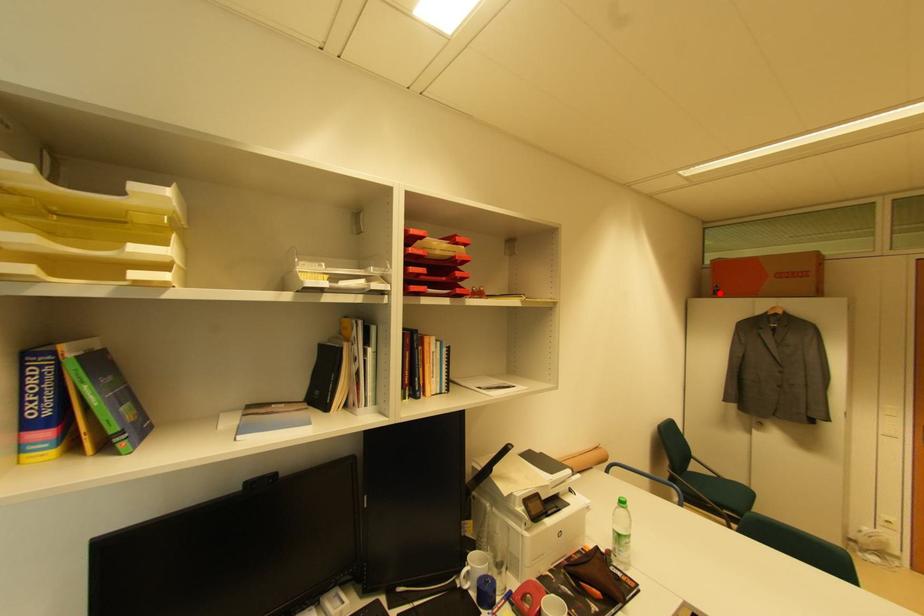
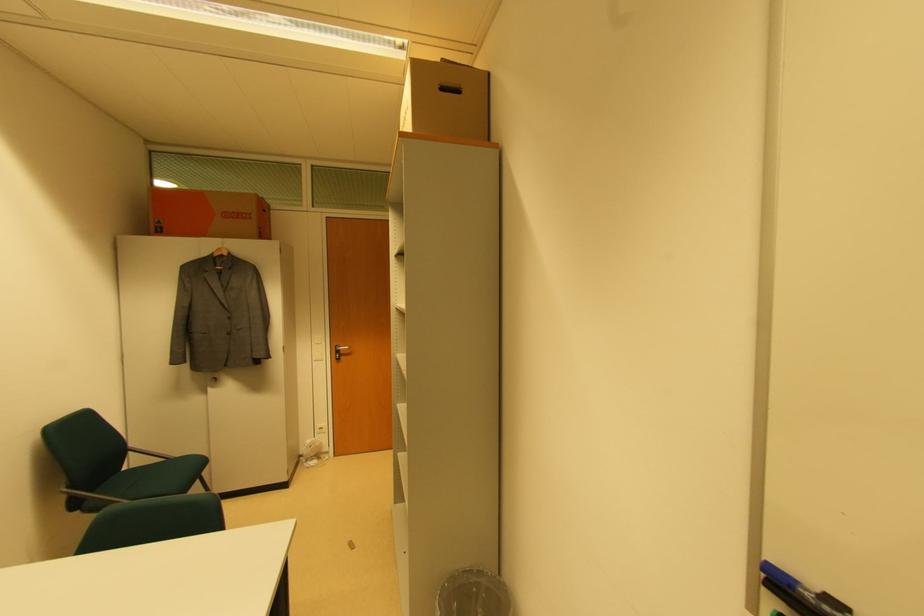
Where in the second image is the point corresponding to the highlighted location from the first image?

(163, 230)